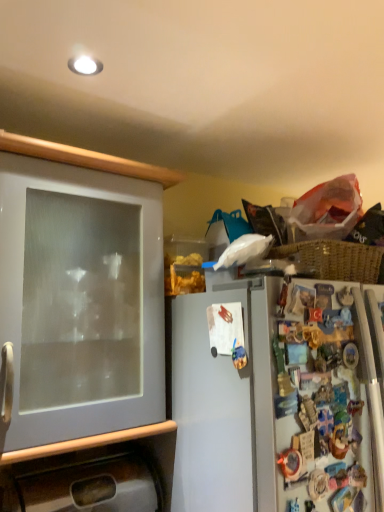
Where is `white glossy cabinet door at left, marked as the 2th cabinetry in a bottom-to-top arrangement`? The width and height of the screenshot is (384, 512). white glossy cabinet door at left, marked as the 2th cabinetry in a bottom-to-top arrangement is located at coordinates (82, 331).

What do you see at coordinates (82, 331) in the screenshot? This screenshot has width=384, height=512. I see `white glossy cabinet door at left, marked as the 2th cabinetry in a bottom-to-top arrangement` at bounding box center [82, 331].

Find the location of `brushed metal sink at lower left, the 2th cabinetry when ordered from top to bottom`. brushed metal sink at lower left, the 2th cabinetry when ordered from top to bottom is located at coordinates (93, 473).

What do you see at coordinates (93, 473) in the screenshot? I see `brushed metal sink at lower left, placed as the first cabinetry when sorted from bottom to top` at bounding box center [93, 473].

I want to click on white glossy cabinet door at left, which is the first cabinetry from top to bottom, so click(82, 331).

Visually, is white glossy cabinet door at left, which is the first cabinetry from top to bottom, positioned to the left or to the right of brushed metal sink at lower left, placed as the first cabinetry when sorted from bottom to top?

Based on their positions, white glossy cabinet door at left, which is the first cabinetry from top to bottom, is located to the left of brushed metal sink at lower left, placed as the first cabinetry when sorted from bottom to top.

In the image, is white glossy cabinet door at left, marked as the 2th cabinetry in a bottom-to-top arrangement, positioned in front of or behind brushed metal sink at lower left, placed as the first cabinetry when sorted from bottom to top?

In the image, white glossy cabinet door at left, marked as the 2th cabinetry in a bottom-to-top arrangement, appears in front of brushed metal sink at lower left, placed as the first cabinetry when sorted from bottom to top.

Is point (91, 484) closer or farther from the camera than point (2, 510)?

Point (91, 484).

From the image's perspective, is white glossy cabinet door at left, which is the first cabinetry from top to bottom, above brushed metal sink at lower left, placed as the first cabinetry when sorted from bottom to top?

Yes, from the image's perspective, white glossy cabinet door at left, which is the first cabinetry from top to bottom, is above brushed metal sink at lower left, placed as the first cabinetry when sorted from bottom to top.

From a real-world perspective, between white glossy cabinet door at left, which is the first cabinetry from top to bottom, and brushed metal sink at lower left, placed as the first cabinetry when sorted from bottom to top, who is vertically higher?

In real-world perspective, white glossy cabinet door at left, which is the first cabinetry from top to bottom, is above.

Can you confirm if white glossy cabinet door at left, which is the first cabinetry from top to bottom, is wider than brushed metal sink at lower left, the 2th cabinetry when ordered from top to bottom?

Yes.

Considering the relative sizes of white glossy cabinet door at left, which is the first cabinetry from top to bottom, and brushed metal sink at lower left, placed as the first cabinetry when sorted from bottom to top, in the image provided, is white glossy cabinet door at left, which is the first cabinetry from top to bottom, taller than brushed metal sink at lower left, placed as the first cabinetry when sorted from bottom to top,?

Indeed, white glossy cabinet door at left, which is the first cabinetry from top to bottom, has a greater height compared to brushed metal sink at lower left, placed as the first cabinetry when sorted from bottom to top.

Which of these two, white glossy cabinet door at left, which is the first cabinetry from top to bottom, or brushed metal sink at lower left, the 2th cabinetry when ordered from top to bottom, is smaller?

With smaller size is brushed metal sink at lower left, the 2th cabinetry when ordered from top to bottom.

Choose the correct answer: Is white glossy cabinet door at left, marked as the 2th cabinetry in a bottom-to-top arrangement, inside brushed metal sink at lower left, placed as the first cabinetry when sorted from bottom to top, or outside it?

white glossy cabinet door at left, marked as the 2th cabinetry in a bottom-to-top arrangement, is spatially situated outside brushed metal sink at lower left, placed as the first cabinetry when sorted from bottom to top.

Is white glossy cabinet door at left, marked as the 2th cabinetry in a bottom-to-top arrangement, far away from brushed metal sink at lower left, the 2th cabinetry when ordered from top to bottom?

No, white glossy cabinet door at left, marked as the 2th cabinetry in a bottom-to-top arrangement, is in close proximity to brushed metal sink at lower left, the 2th cabinetry when ordered from top to bottom.

Does white glossy cabinet door at left, which is the first cabinetry from top to bottom, turn towards brushed metal sink at lower left, placed as the first cabinetry when sorted from bottom to top?

No, white glossy cabinet door at left, which is the first cabinetry from top to bottom, is not aimed at brushed metal sink at lower left, placed as the first cabinetry when sorted from bottom to top.

Measure the distance from white glossy cabinet door at left, marked as the 2th cabinetry in a bottom-to-top arrangement, to brushed metal sink at lower left, placed as the first cabinetry when sorted from bottom to top.

white glossy cabinet door at left, marked as the 2th cabinetry in a bottom-to-top arrangement, is 5.87 inches from brushed metal sink at lower left, placed as the first cabinetry when sorted from bottom to top.

Where is `cabinetry that is on the right side of white glossy cabinet door at left, which is the first cabinetry from top to bottom`? This screenshot has width=384, height=512. cabinetry that is on the right side of white glossy cabinet door at left, which is the first cabinetry from top to bottom is located at coordinates (93, 473).

Which object is positioned more to the right, brushed metal sink at lower left, the 2th cabinetry when ordered from top to bottom, or white glossy cabinet door at left, marked as the 2th cabinetry in a bottom-to-top arrangement?

Positioned to the right is brushed metal sink at lower left, the 2th cabinetry when ordered from top to bottom.

Which is behind, brushed metal sink at lower left, placed as the first cabinetry when sorted from bottom to top, or white glossy cabinet door at left, which is the first cabinetry from top to bottom?

Positioned behind is brushed metal sink at lower left, placed as the first cabinetry when sorted from bottom to top.

Considering the points (45, 474) and (140, 406), which point is behind, point (45, 474) or point (140, 406)?

The point (45, 474) is farther.

From the image's perspective, is brushed metal sink at lower left, placed as the first cabinetry when sorted from bottom to top, positioned above or below white glossy cabinet door at left, marked as the 2th cabinetry in a bottom-to-top arrangement?

Based on their image positions, brushed metal sink at lower left, placed as the first cabinetry when sorted from bottom to top, is located beneath white glossy cabinet door at left, marked as the 2th cabinetry in a bottom-to-top arrangement.

From a real-world perspective, between brushed metal sink at lower left, the 2th cabinetry when ordered from top to bottom, and white glossy cabinet door at left, marked as the 2th cabinetry in a bottom-to-top arrangement, who is vertically lower?

brushed metal sink at lower left, the 2th cabinetry when ordered from top to bottom, is physically lower.

Does brushed metal sink at lower left, the 2th cabinetry when ordered from top to bottom, have a lesser width compared to white glossy cabinet door at left, marked as the 2th cabinetry in a bottom-to-top arrangement?

Yes, brushed metal sink at lower left, the 2th cabinetry when ordered from top to bottom, is thinner than white glossy cabinet door at left, marked as the 2th cabinetry in a bottom-to-top arrangement.

Does brushed metal sink at lower left, the 2th cabinetry when ordered from top to bottom, have a lesser height compared to white glossy cabinet door at left, marked as the 2th cabinetry in a bottom-to-top arrangement?

Yes, brushed metal sink at lower left, the 2th cabinetry when ordered from top to bottom, is shorter than white glossy cabinet door at left, marked as the 2th cabinetry in a bottom-to-top arrangement.

Is brushed metal sink at lower left, placed as the first cabinetry when sorted from bottom to top, bigger or smaller than white glossy cabinet door at left, which is the first cabinetry from top to bottom?

Considering their sizes, brushed metal sink at lower left, placed as the first cabinetry when sorted from bottom to top, takes up less space than white glossy cabinet door at left, which is the first cabinetry from top to bottom.

From the picture: Is white glossy cabinet door at left, marked as the 2th cabinetry in a bottom-to-top arrangement, inside brushed metal sink at lower left, the 2th cabinetry when ordered from top to bottom?

No.

Would you consider brushed metal sink at lower left, the 2th cabinetry when ordered from top to bottom, to be distant from white glossy cabinet door at left, marked as the 2th cabinetry in a bottom-to-top arrangement?

No, there isn't a large distance between brushed metal sink at lower left, the 2th cabinetry when ordered from top to bottom, and white glossy cabinet door at left, marked as the 2th cabinetry in a bottom-to-top arrangement.

Is brushed metal sink at lower left, placed as the first cabinetry when sorted from bottom to top, aimed at white glossy cabinet door at left, marked as the 2th cabinetry in a bottom-to-top arrangement?

No, brushed metal sink at lower left, placed as the first cabinetry when sorted from bottom to top, is not facing towards white glossy cabinet door at left, marked as the 2th cabinetry in a bottom-to-top arrangement.

This screenshot has height=512, width=384. Identify the location of cabinetry behind the white glossy cabinet door at left, marked as the 2th cabinetry in a bottom-to-top arrangement. (93, 473).

In the image, there is a white glossy cabinet door at left, marked as the 2th cabinetry in a bottom-to-top arrangement. What are the coordinates of `cabinetry below it (from the image's perspective)` in the screenshot? It's located at (93, 473).

You are a GUI agent. You are given a task and a screenshot of the screen. Output one action in this format:
    pyautogui.click(x=<x>, y=<y>)
    Task: Click on the cabinetry above the brushed metal sink at lower left, placed as the first cabinetry when sorted from bottom to top (from the image's perspective)
    The image size is (384, 512).
    Given the screenshot: What is the action you would take?
    pyautogui.click(x=82, y=331)